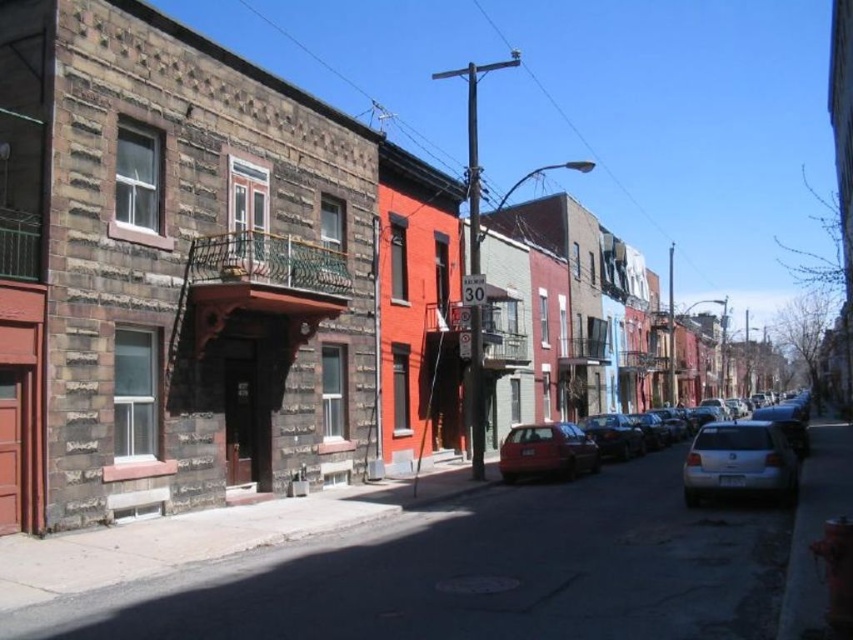
Question: Is the position of matte silver sedan at center more distant than that of shiny black sedan at center?

Choices:
 (A) no
 (B) yes

Answer: (A)

Question: Which point is closer to the camera?

Choices:
 (A) (604, 417)
 (B) (735, 490)
 (C) (589, 436)

Answer: (B)

Question: Does matte silver sedan at center appear on the right side of silver metallic sedan at lower right?

Choices:
 (A) yes
 (B) no

Answer: (A)

Question: Which point appears closest to the camera in this image?

Choices:
 (A) (793, 477)
 (B) (585, 456)

Answer: (A)

Question: In this image, where is matte red car at center located relative to shiny black sedan at center?

Choices:
 (A) below
 (B) above

Answer: (B)

Question: Which point appears farthest from the camera in this image?

Choices:
 (A) (801, 452)
 (B) (613, 422)

Answer: (B)